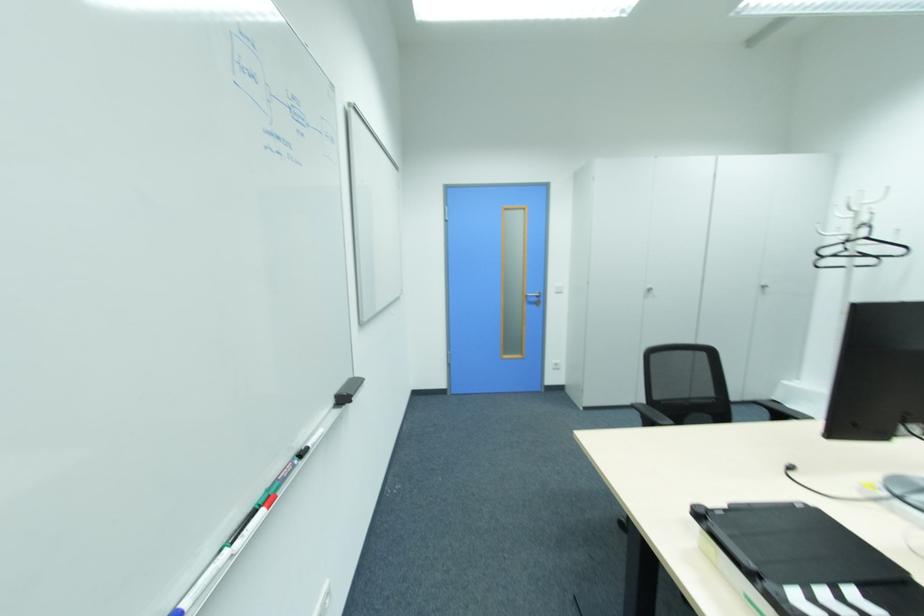
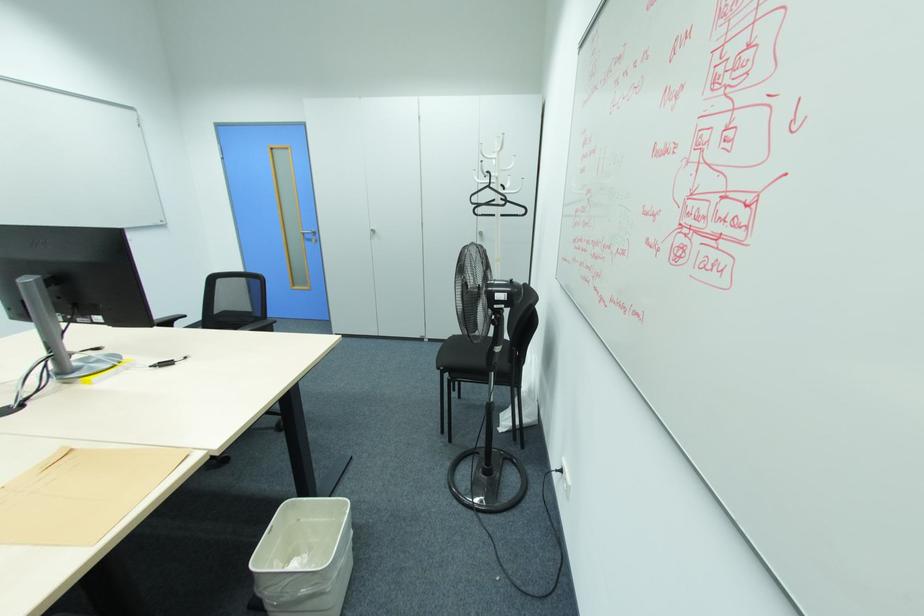
Question: The images are taken continuously from a first-person perspective. In which direction are you moving?

Choices:
 (A) Left
 (B) Right
 (C) Forward
 (D) Backward

Answer: (B)